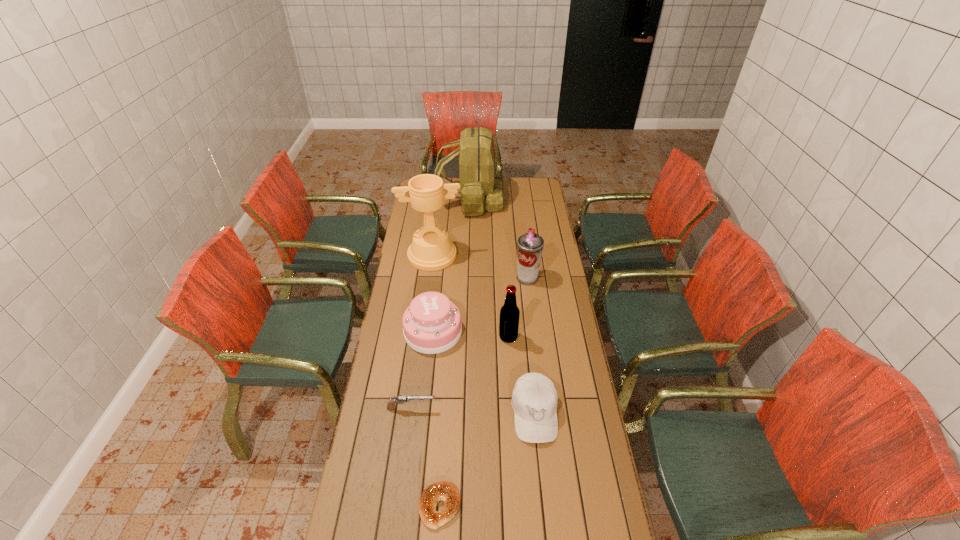
Identify the location of free location that satisfies the following two spatial constraints: 1. on the front side of the aerosol can; 2. aiming along the barrel of the second shortest object. This screenshot has height=540, width=960. (542, 408).

This screenshot has height=540, width=960. Identify the location of vacant space that satisfies the following two spatial constraints: 1. on the front side of the award; 2. on the left side of the bagel. (400, 506).

Locate an element on the screen. The height and width of the screenshot is (540, 960). free spot that satisfies the following two spatial constraints: 1. on the front-facing side of the backpack; 2. on the front side of the cake is located at coordinates (x=467, y=332).